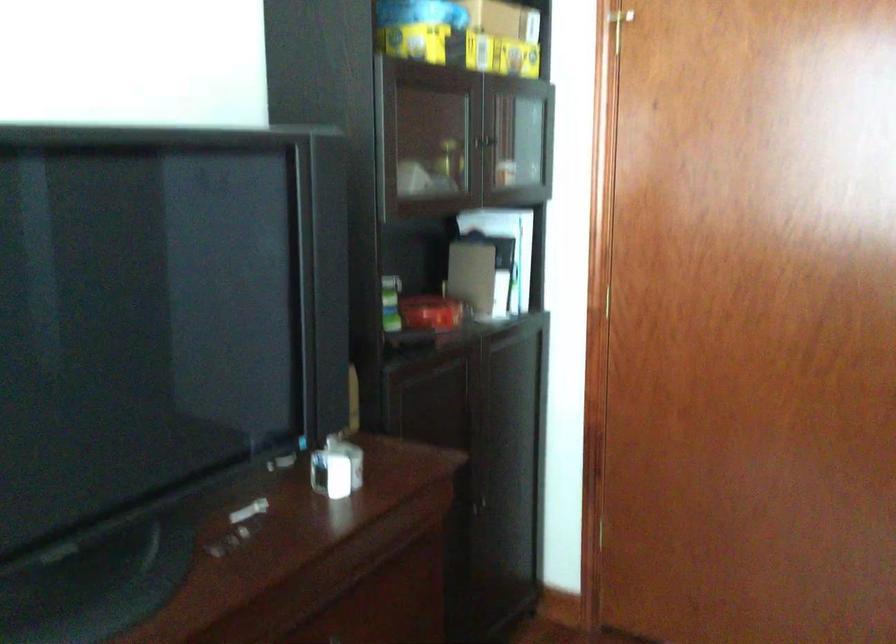
Which object does [431,313] point to?

This point indicates the red tin box.